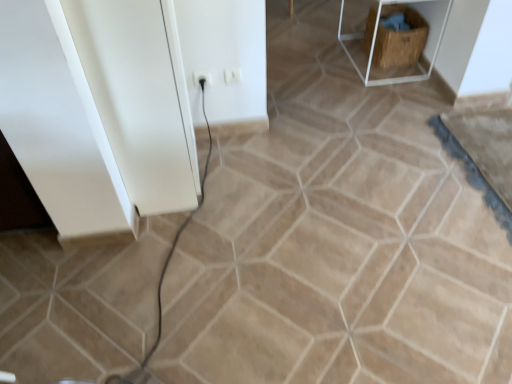
Question: Considering the relative sizes of white glossy cabinet at left and white plastic electric outlet at center, marked as the 1th electric outlet in a right-to-left arrangement, in the image provided, is white glossy cabinet at left wider than white plastic electric outlet at center, marked as the 1th electric outlet in a right-to-left arrangement,?

Choices:
 (A) no
 (B) yes

Answer: (B)

Question: Is white plastic electric outlet at center, which is the second electric outlet in left-to-right order, completely or partially inside white glossy cabinet at left?

Choices:
 (A) no
 (B) yes

Answer: (A)

Question: From a real-world perspective, is white glossy cabinet at left on white plastic electric outlet at center, marked as the 1th electric outlet in a right-to-left arrangement?

Choices:
 (A) no
 (B) yes

Answer: (B)

Question: Does white glossy cabinet at left have a greater height compared to white plastic electric outlet at center, marked as the 1th electric outlet in a right-to-left arrangement?

Choices:
 (A) yes
 (B) no

Answer: (A)

Question: From the image's perspective, does white glossy cabinet at left appear higher than white plastic electric outlet at center, marked as the 1th electric outlet in a right-to-left arrangement?

Choices:
 (A) yes
 (B) no

Answer: (B)

Question: Is white glossy cabinet at left touching white plastic electric outlet at center, marked as the 1th electric outlet in a right-to-left arrangement?

Choices:
 (A) no
 (B) yes

Answer: (A)

Question: Considering the relative sizes of brown woven crate at upper right and wooden crate at upper right in the image provided, is brown woven crate at upper right shorter than wooden crate at upper right?

Choices:
 (A) no
 (B) yes

Answer: (B)

Question: From the image's perspective, does brown woven crate at upper right appear higher than wooden crate at upper right?

Choices:
 (A) no
 (B) yes

Answer: (A)

Question: Does brown woven crate at upper right have a lesser width compared to wooden crate at upper right?

Choices:
 (A) yes
 (B) no

Answer: (A)

Question: From the image's perspective, does brown woven crate at upper right appear lower than wooden crate at upper right?

Choices:
 (A) yes
 (B) no

Answer: (A)

Question: From a real-world perspective, is brown woven crate at upper right located higher than wooden crate at upper right?

Choices:
 (A) no
 (B) yes

Answer: (A)

Question: Is brown woven crate at upper right far away from wooden crate at upper right?

Choices:
 (A) no
 (B) yes

Answer: (A)

Question: Is wooden crate at upper right aimed at white plastic electric outlet at center, marked as the 1th electric outlet in a right-to-left arrangement?

Choices:
 (A) no
 (B) yes

Answer: (B)